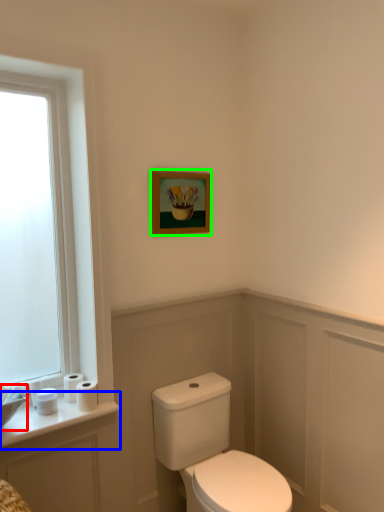
Question: Which is nearer to the sink (highlighted by a red box)? counter top (highlighted by a blue box) or picture frame (highlighted by a green box).

Choices:
 (A) counter top
 (B) picture frame

Answer: (A)